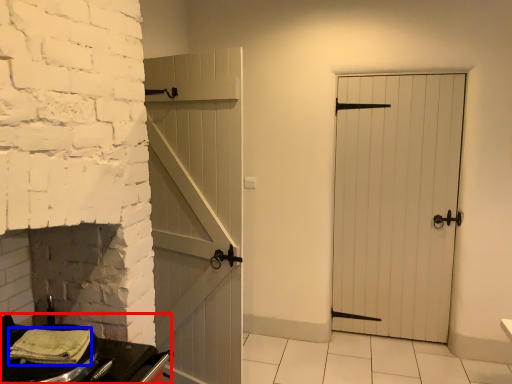
Question: Which point is further to the camera, table (highlighted by a red box) or material (highlighted by a blue box)?

Choices:
 (A) table
 (B) material

Answer: (B)